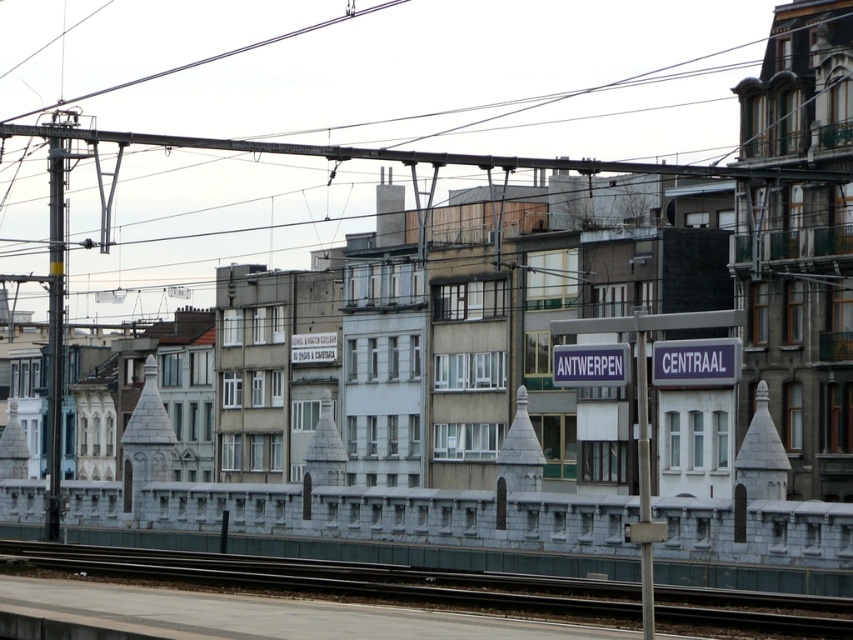
A city planner is designing a new pedestrian path that must pass between the smooth concrete train at center and the nearest building. Given that the nearest building is 1.2 meters away from the train, can a person of average height walk safely through this path without touching the train?

The smooth concrete train at center is positioned at point [370,524]. Since the nearest building is 1.2 meters away from the train, an average person can walk safely through the path as 1.2 meters provides sufficient clearance.

Based on the photo, you are a maintenance worker needing to inspect the black metal track at center and the metallic gray pole at left. Based on the scene, which object is closer to the ground?

The black metal track at center is closer to the ground because it is positioned below the metallic gray pole at left.

You are a pedestrian standing on the sidewalk and see the smooth concrete train at center and the metallic gray pole at left. Which object is closer to you?

The smooth concrete train at center is closer to you than the metallic gray pole at left.